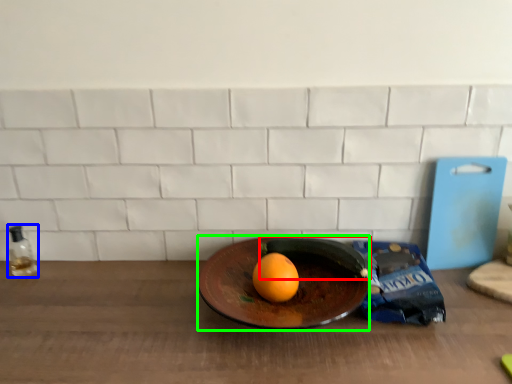
Question: Which is farther away from banana (highlighted by a red box)? bottle (highlighted by a blue box) or plate (highlighted by a green box)?

Choices:
 (A) bottle
 (B) plate

Answer: (A)